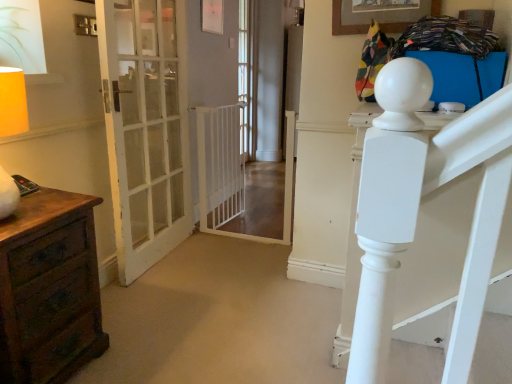
This screenshot has height=384, width=512. I want to click on vacant space to the right of white glass door at left, so click(222, 269).